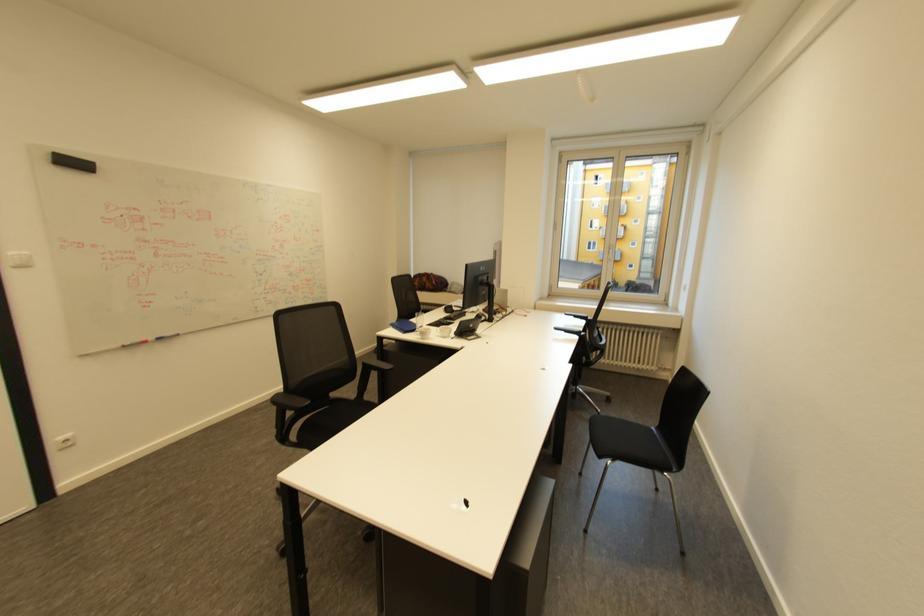
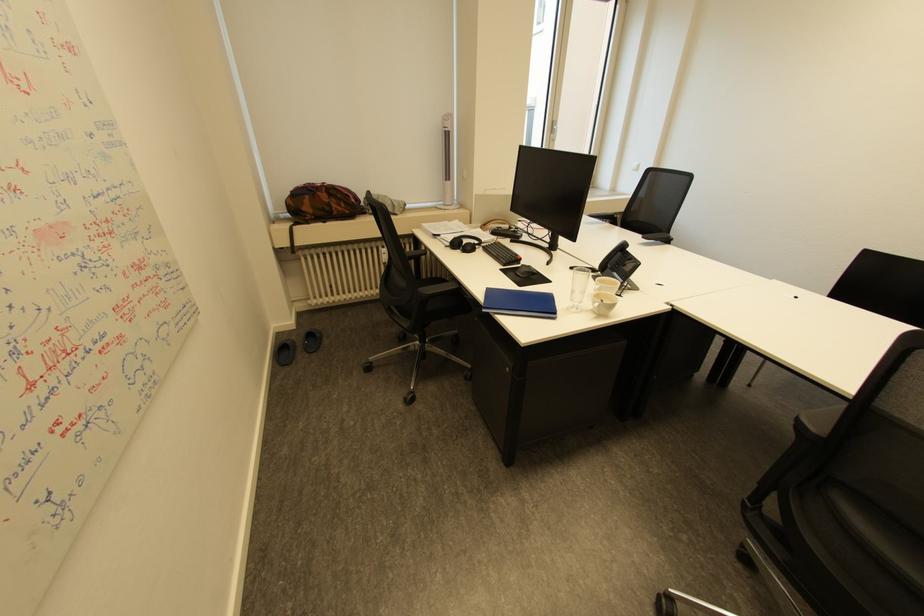
Find the pixel in the second image that matches (x=411, y=331) in the first image.

(562, 314)